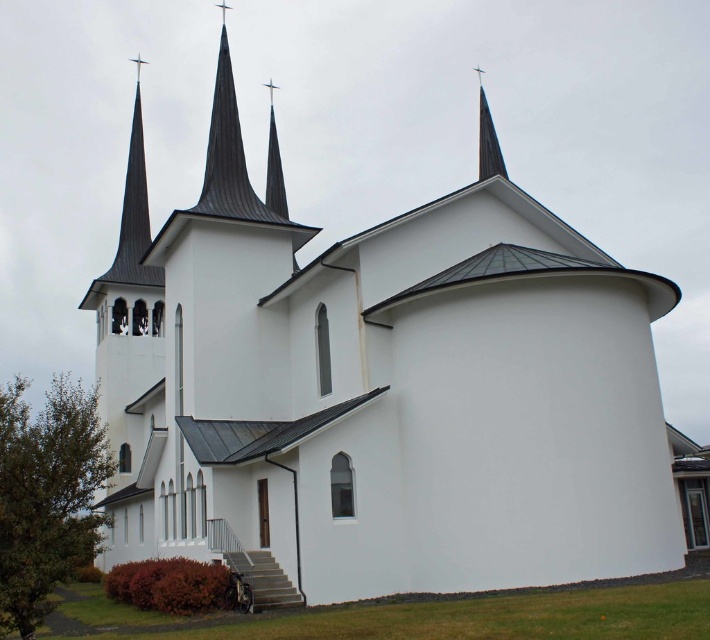
Question: Does shiny metallic spire at upper center appear on the right side of shiny silver spire at center?

Choices:
 (A) no
 (B) yes

Answer: (B)

Question: Does shiny metallic spire at upper center come behind shiny silver spire at center?

Choices:
 (A) yes
 (B) no

Answer: (B)

Question: Is shiny metallic spire at upper center wider than shiny silver spire at center?

Choices:
 (A) no
 (B) yes

Answer: (B)